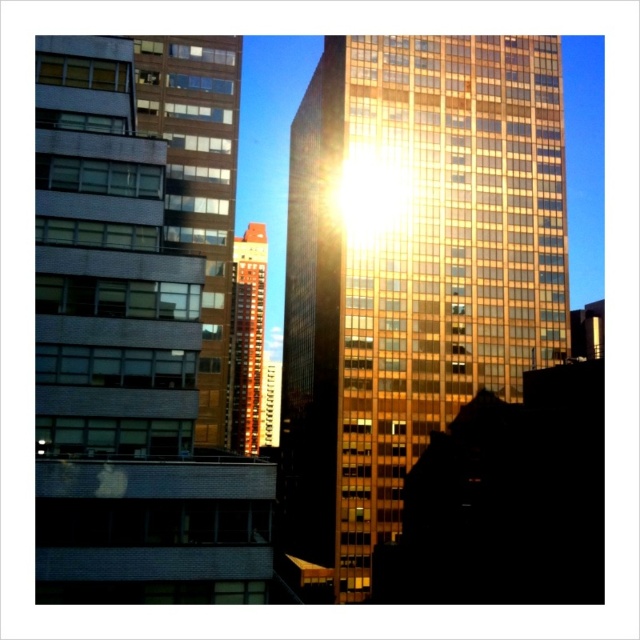
Who is positioned more to the left, brown glass building at upper left or brown brick building at center?

Positioned to the left is brown brick building at center.

Does brown glass building at upper left lie in front of brown brick building at center?

Yes, it is in front of brown brick building at center.

Which is in front, point (177, 124) or point (250, 449)?

Point (177, 124) is in front.

Identify the location of brown glass building at upper left. The width and height of the screenshot is (640, 640). (196, 186).

Does gold reflective glass building at center have a larger size compared to brown brick building at center?

No, gold reflective glass building at center is not bigger than brown brick building at center.

Which of these two, gold reflective glass building at center or brown brick building at center, stands taller?

gold reflective glass building at center

Is point (493, 387) positioned before point (250, 336)?

Yes, it is in front of point (250, 336).

Find the location of a particular element. The image size is (640, 640). gold reflective glass building at center is located at coordinates (412, 268).

Does gold reflective glass building at center have a lesser width compared to brown glass building at upper left?

In fact, gold reflective glass building at center might be wider than brown glass building at upper left.

Who is lower down, gold reflective glass building at center or brown glass building at upper left?

brown glass building at upper left is lower down.

This screenshot has width=640, height=640. Describe the element at coordinates (412, 268) in the screenshot. I see `gold reflective glass building at center` at that location.

At what (x,y) coordinates should I click in order to perform the action: click on gold reflective glass building at center. Please return your answer as a coordinate pair (x, y). Looking at the image, I should click on (412, 268).